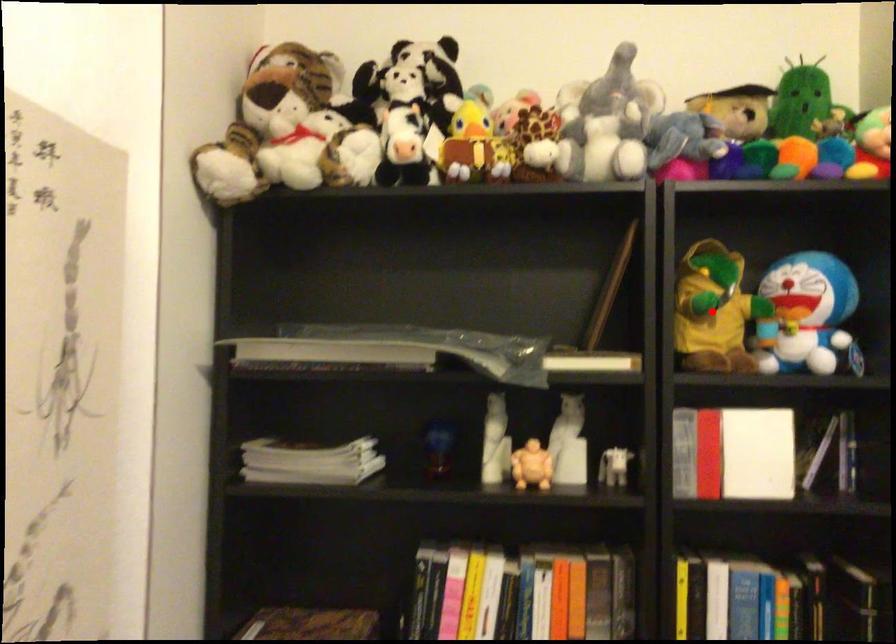
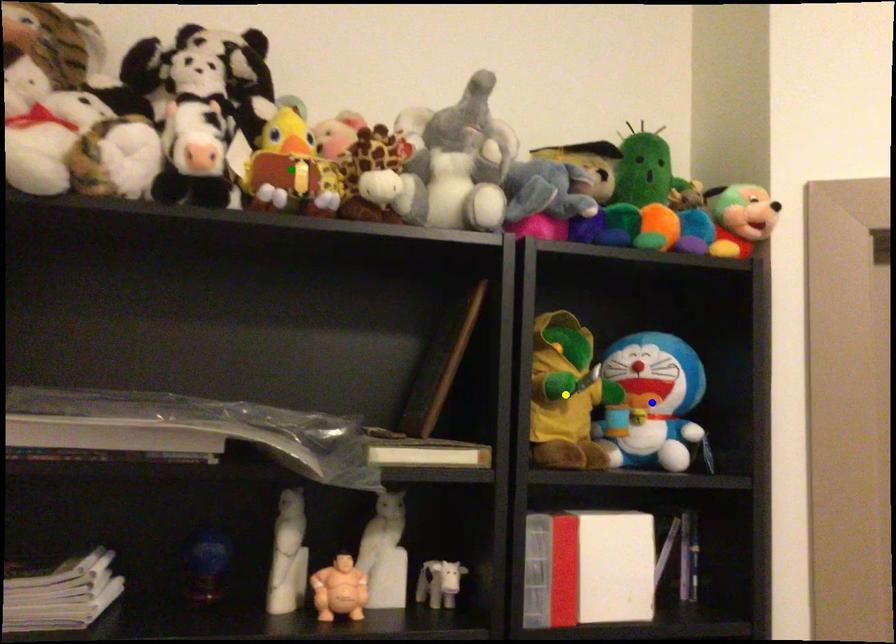
Question: I am providing you with two images of the same scene from different viewpoints. A red point is marked on the first image. You are given multiple points on the second image. Which point in image 2 represents the same 3d spot as the red point in image 1?

Choices:
 (A) blue point
 (B) green point
 (C) yellow point

Answer: (C)